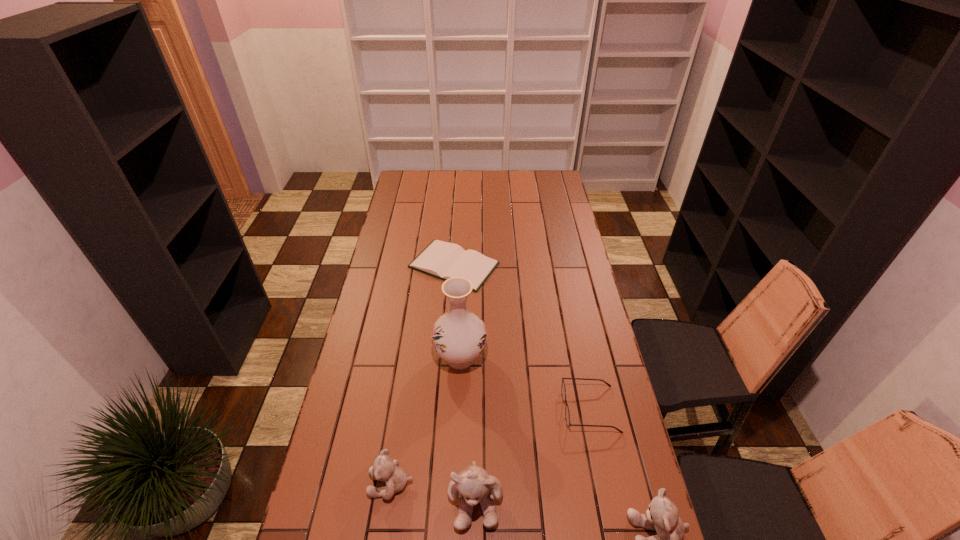
Identify the location of object located at the right edge. (567, 415).

This screenshot has width=960, height=540. I want to click on free space at the far edge of the desktop, so click(530, 183).

Where is `blank space at the left edge of the desktop`? This screenshot has height=540, width=960. blank space at the left edge of the desktop is located at coordinates (386, 365).

You are a GUI agent. You are given a task and a screenshot of the screen. Output one action in this format:
    pyautogui.click(x=<x>, y=<y>)
    Task: Click on the free spot at the right edge of the desktop
    
    Given the screenshot: What is the action you would take?
    pyautogui.click(x=623, y=426)

In the image, there is a desktop. At what (x,y) coordinates should I click in order to perform the action: click on free region at the far left corner. Please return your answer as a coordinate pair (x, y). This screenshot has width=960, height=540. Looking at the image, I should click on (411, 174).

Locate an element on the screen. The width and height of the screenshot is (960, 540). vacant area at the near left corner is located at coordinates (345, 538).

In the image, there is a desktop. Where is `vacant space at the near right corner`? The image size is (960, 540). vacant space at the near right corner is located at coordinates (599, 519).

Image resolution: width=960 pixels, height=540 pixels. I want to click on free space that is in between the fifth nearest object and the second teddy bear from right to left, so click(x=468, y=428).

The height and width of the screenshot is (540, 960). Identify the location of free space that is in between the second teddy bear from right to left and the shortest object. tap(465, 382).

Where is `unoccupied position between the second teddy bear from right to left and the second shortest object`? The height and width of the screenshot is (540, 960). unoccupied position between the second teddy bear from right to left and the second shortest object is located at coordinates (533, 454).